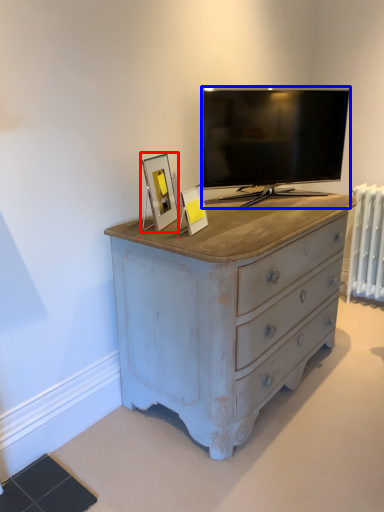
Question: Which of the following is the closest to the observer, picture frame (highlighted by a red box) or television (highlighted by a blue box)?

Choices:
 (A) picture frame
 (B) television

Answer: (A)